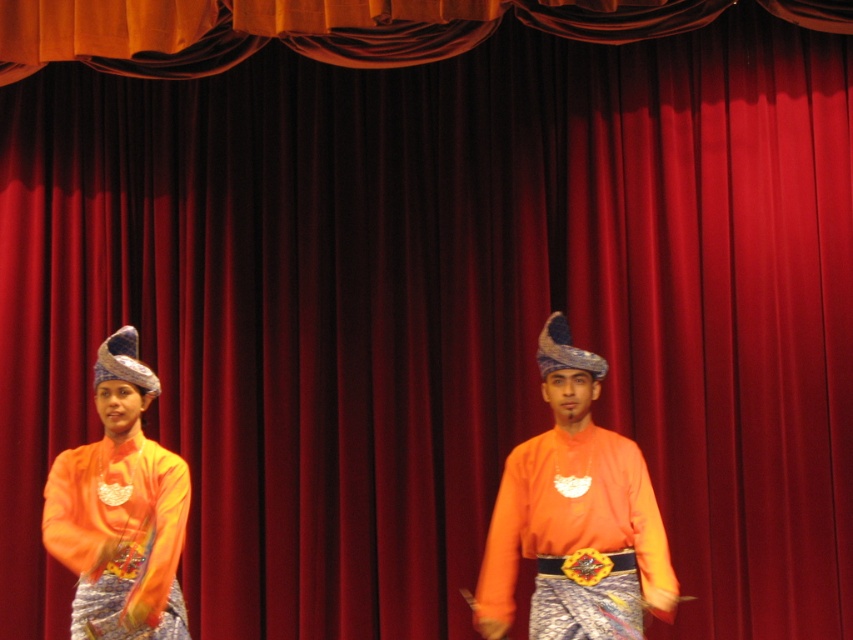
You are a stagehand preparing to adjust the lighting for the performance. You notice two orange elements on stage, the orange matte shirt at center and the matte orange fabric at left. Which one should you focus your spotlight on to ensure it is illuminated properly, considering their heights?

The orange matte shirt at center is much taller than the matte orange fabric at left, so you should focus the spotlight on the orange matte shirt at center to ensure proper illumination.

You are standing in front of the stage and notice a point marked at coordinates (575, 516). Based on the scene description, can you identify what object or part of the scene this point corresponds to?

The point at (575, 516) is located on the orange matte shirt at center, which is part of the woman performer on the left.

You are a stagehand preparing to move a 3.5 feet wide equipment cart between the orange matte shirt at center and the matte orange fabric at left. Can the cart fit through the space between them?

The distance between the orange matte shirt at center and the matte orange fabric at left is 3.79 feet, so the 3.5 feet wide equipment cart can fit through the space since it is slightly narrower than the available distance.